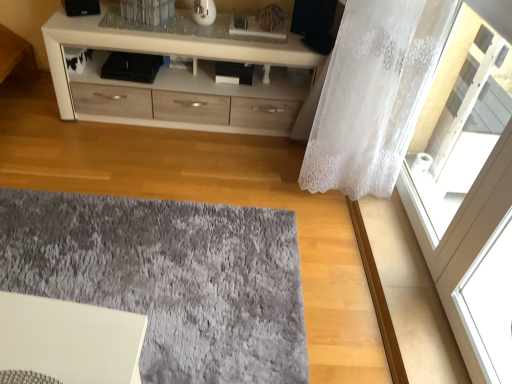
Question: Does white lace curtain at right come behind white glossy cabinet at upper center?

Choices:
 (A) no
 (B) yes

Answer: (A)

Question: Could you tell me if white lace curtain at right is turned towards white glossy cabinet at upper center?

Choices:
 (A) yes
 (B) no

Answer: (B)

Question: Is white lace curtain at right beside white glossy cabinet at upper center?

Choices:
 (A) yes
 (B) no

Answer: (B)

Question: Is white lace curtain at right turned away from white glossy cabinet at upper center?

Choices:
 (A) no
 (B) yes

Answer: (A)

Question: Does white lace curtain at right lie in front of white glossy cabinet at upper center?

Choices:
 (A) no
 (B) yes

Answer: (B)

Question: From their relative heights in the image, would you say white lace curtain at right is taller or shorter than white lace curtain at right?

Choices:
 (A) short
 (B) tall

Answer: (B)

Question: In the image, is white lace curtain at right on the left side or the right side of white lace curtain at right?

Choices:
 (A) right
 (B) left

Answer: (B)

Question: Is white lace curtain at right wider or thinner than white lace curtain at right?

Choices:
 (A) wide
 (B) thin

Answer: (A)

Question: Is point (361, 104) closer or farther from the camera than point (429, 185)?

Choices:
 (A) closer
 (B) farther

Answer: (A)

Question: Considering the relative positions of white glossy cabinet at upper center and gray shaggy rug at center in the image provided, is white glossy cabinet at upper center to the left or to the right of gray shaggy rug at center?

Choices:
 (A) right
 (B) left

Answer: (A)

Question: From the image's perspective, is white glossy cabinet at upper center located above or below gray shaggy rug at center?

Choices:
 (A) above
 (B) below

Answer: (A)

Question: From a real-world perspective, is white glossy cabinet at upper center physically located above or below gray shaggy rug at center?

Choices:
 (A) below
 (B) above

Answer: (B)

Question: Considering the positions of white glossy cabinet at upper center and gray shaggy rug at center in the image, is white glossy cabinet at upper center taller or shorter than gray shaggy rug at center?

Choices:
 (A) short
 (B) tall

Answer: (B)

Question: From their relative heights in the image, would you say white lace curtain at right is taller or shorter than gray shaggy rug at center?

Choices:
 (A) short
 (B) tall

Answer: (B)

Question: Is white lace curtain at right situated inside gray shaggy rug at center or outside?

Choices:
 (A) outside
 (B) inside

Answer: (A)